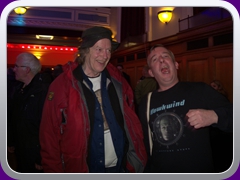
Find the location of a particular element. This screenshot has width=240, height=180. sconce light is located at coordinates (166, 18).